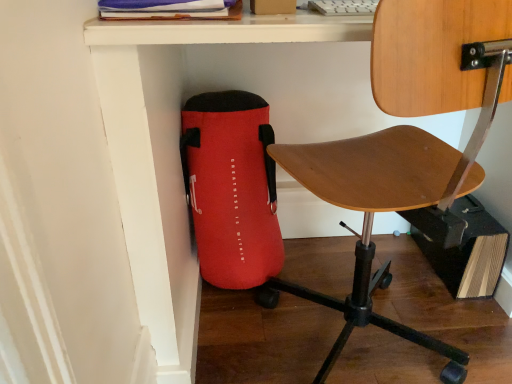
Image resolution: width=512 pixels, height=384 pixels. Describe the element at coordinates (231, 188) in the screenshot. I see `red fabric bag at lower left` at that location.

Locate an element on the screen. red fabric bag at lower left is located at coordinates (231, 188).

The height and width of the screenshot is (384, 512). Identify the location of wooden seat at center. (409, 146).

This screenshot has width=512, height=384. Describe the element at coordinates (409, 146) in the screenshot. I see `wooden seat at center` at that location.

You are a GUI agent. You are given a task and a screenshot of the screen. Output one action in this format:
    pyautogui.click(x=<x>, y=<y>)
    Task: Click on the red fabric bag at lower left
    This screenshot has width=512, height=384.
    Given the screenshot: What is the action you would take?
    click(x=231, y=188)

Considering the positions of objects wooden seat at center and red fabric bag at lower left in the image provided, who is more to the left, wooden seat at center or red fabric bag at lower left?

red fabric bag at lower left is more to the left.

In the image, is wooden seat at center positioned in front of or behind red fabric bag at lower left?

wooden seat at center is positioned closer to the viewer than red fabric bag at lower left.

Is point (335, 186) positioned behind point (219, 170)?

That is False.

From the image's perspective, between wooden seat at center and red fabric bag at lower left, which one is located above?

wooden seat at center, from the image's perspective.

From a real-world perspective, is wooden seat at center above or below red fabric bag at lower left?

In terms of real-world spatial position, wooden seat at center is above red fabric bag at lower left.

Considering the relative sizes of wooden seat at center and red fabric bag at lower left in the image provided, is wooden seat at center thinner than red fabric bag at lower left?

In fact, wooden seat at center might be wider than red fabric bag at lower left.

Is wooden seat at center taller or shorter than red fabric bag at lower left?

Considering their sizes, wooden seat at center has more height than red fabric bag at lower left.

Based on the photo, considering the sizes of objects wooden seat at center and red fabric bag at lower left in the image provided, who is bigger, wooden seat at center or red fabric bag at lower left?

Bigger between the two is wooden seat at center.

Is wooden seat at center not within red fabric bag at lower left?

Absolutely, wooden seat at center is external to red fabric bag at lower left.

Would you consider wooden seat at center to be distant from red fabric bag at lower left?

No, wooden seat at center is not far away from red fabric bag at lower left.

Is wooden seat at center positioned with its back to red fabric bag at lower left?

No, wooden seat at center is not facing away from red fabric bag at lower left.

Identify the location of chair above the red fabric bag at lower left (from the image's perspective). Image resolution: width=512 pixels, height=384 pixels. click(409, 146).

Which object is positioned more to the left, red fabric bag at lower left or wooden seat at center?

Positioned to the left is red fabric bag at lower left.

Who is more distant, red fabric bag at lower left or wooden seat at center?

red fabric bag at lower left is further away from the camera.

Which point is more distant from viewer, (215, 242) or (389, 206)?

Point (215, 242)

From the image's perspective, is red fabric bag at lower left on wooden seat at center?

Actually, red fabric bag at lower left appears below wooden seat at center in the image.

From a real-world perspective, is red fabric bag at lower left located beneath wooden seat at center?

Indeed, from a real-world perspective, red fabric bag at lower left is positioned beneath wooden seat at center.

Is red fabric bag at lower left thinner than wooden seat at center?

Correct, the width of red fabric bag at lower left is less than that of wooden seat at center.

Looking at this image, is red fabric bag at lower left shorter than wooden seat at center?

Correct, red fabric bag at lower left is not as tall as wooden seat at center.

Is red fabric bag at lower left bigger than wooden seat at center?

Actually, red fabric bag at lower left might be smaller than wooden seat at center.

Is red fabric bag at lower left completely or partially outside of wooden seat at center?

That's correct, red fabric bag at lower left is outside of wooden seat at center.

Would you say red fabric bag at lower left is a long distance from wooden seat at center?

No, there isn't a large distance between red fabric bag at lower left and wooden seat at center.

Is red fabric bag at lower left aimed at wooden seat at center?

Yes, red fabric bag at lower left is turned towards wooden seat at center.

The width and height of the screenshot is (512, 384). Find the location of `chair that is above the red fabric bag at lower left (from a real-world perspective)`. chair that is above the red fabric bag at lower left (from a real-world perspective) is located at coordinates (409, 146).

Where is `bag below the wooden seat at center (from a real-world perspective)`? bag below the wooden seat at center (from a real-world perspective) is located at coordinates point(231,188).

Where is `bag below the wooden seat at center (from the image's perspective)`? The width and height of the screenshot is (512, 384). bag below the wooden seat at center (from the image's perspective) is located at coordinates (231, 188).